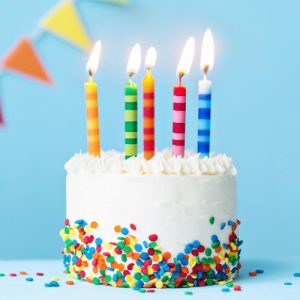
Locate an element on the screen. The height and width of the screenshot is (300, 300). birthday candle is located at coordinates (91, 115), (131, 122), (149, 121), (177, 123), (201, 125).